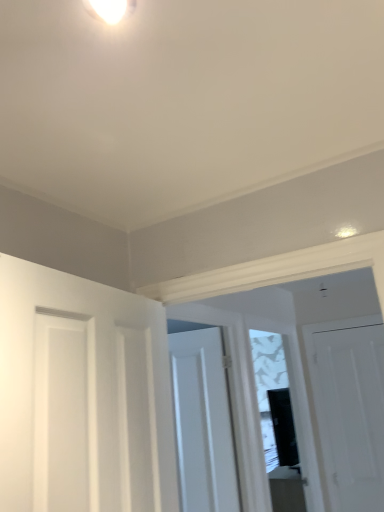
Question: Is white matte door at right, the 3th door from the left, surrounded by white glossy light fixture at upper center?

Choices:
 (A) yes
 (B) no

Answer: (B)

Question: Would you say white glossy light fixture at upper center is a long distance from white matte door at right, placed as the first door when sorted from right to left?

Choices:
 (A) no
 (B) yes

Answer: (B)

Question: From the image's perspective, would you say white glossy light fixture at upper center is positioned over white matte door at right, the third door in the front-to-back sequence?

Choices:
 (A) no
 (B) yes

Answer: (B)

Question: From a real-world perspective, is white glossy light fixture at upper center located higher than white matte door at right, arranged as the first door when viewed from the back?

Choices:
 (A) no
 (B) yes

Answer: (B)

Question: Can you confirm if white glossy light fixture at upper center is positioned to the right of white matte door at right, the third door in the front-to-back sequence?

Choices:
 (A) no
 (B) yes

Answer: (A)

Question: Is white glossy light fixture at upper center thinner than white matte door at right, arranged as the first door when viewed from the back?

Choices:
 (A) yes
 (B) no

Answer: (B)

Question: Is white matte door at left, arranged as the third door when viewed from the back, completely or partially inside white glossy light fixture at upper center?

Choices:
 (A) no
 (B) yes

Answer: (A)

Question: Does white glossy light fixture at upper center lie behind white matte door at left, arranged as the 3th door when viewed from the right?

Choices:
 (A) no
 (B) yes

Answer: (B)

Question: Can you confirm if white glossy light fixture at upper center is positioned to the right of white matte door at left, arranged as the third door when viewed from the back?

Choices:
 (A) yes
 (B) no

Answer: (A)

Question: Is white glossy light fixture at upper center not inside white matte door at left, arranged as the third door when viewed from the back?

Choices:
 (A) no
 (B) yes

Answer: (B)

Question: Is white glossy light fixture at upper center not near white matte door at left, arranged as the third door when viewed from the back?

Choices:
 (A) yes
 (B) no

Answer: (B)

Question: Is white glossy light fixture at upper center positioned before white matte door at left, acting as the first door starting from the front?

Choices:
 (A) no
 (B) yes

Answer: (A)

Question: Is transparent glass window at center positioned behind white matte door at right, the third door in the front-to-back sequence?

Choices:
 (A) yes
 (B) no

Answer: (B)